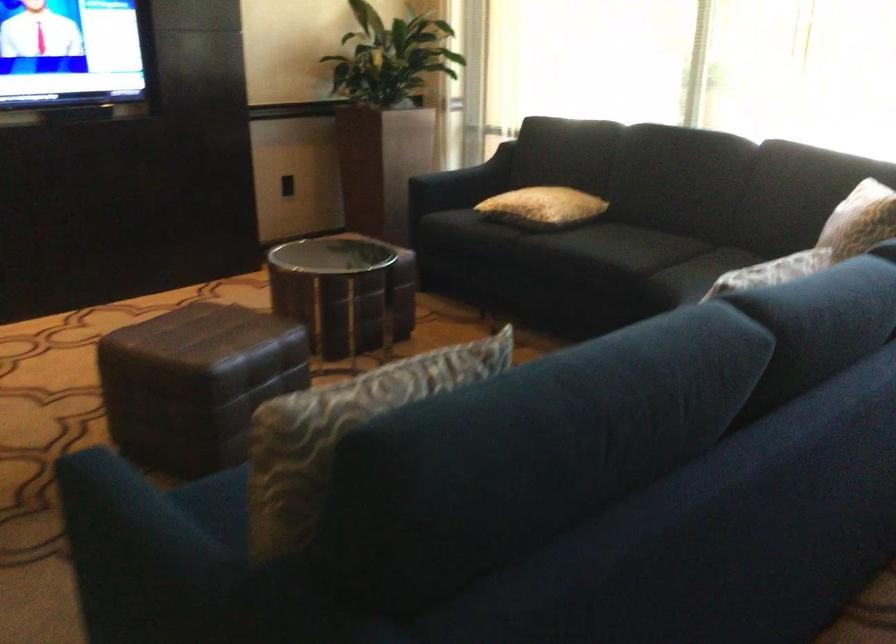
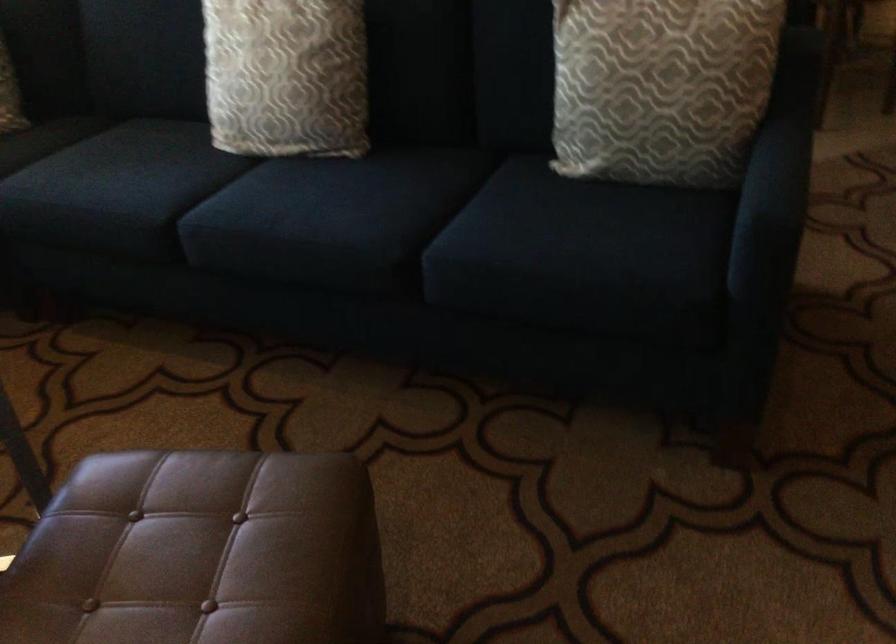
In the second image, find the point that corresponds to (x=195, y=383) in the first image.

(373, 476)